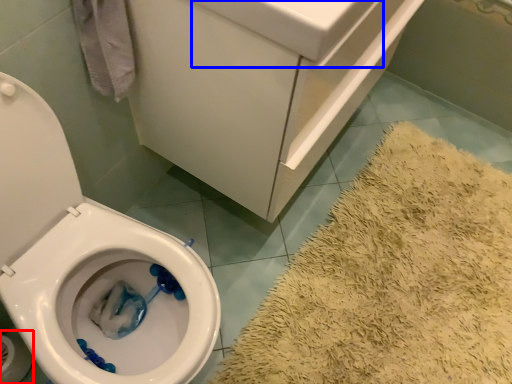
Question: Which of the following is the closest to the observer, toilet paper (highlighted by a red box) or sink (highlighted by a blue box)?

Choices:
 (A) toilet paper
 (B) sink

Answer: (B)